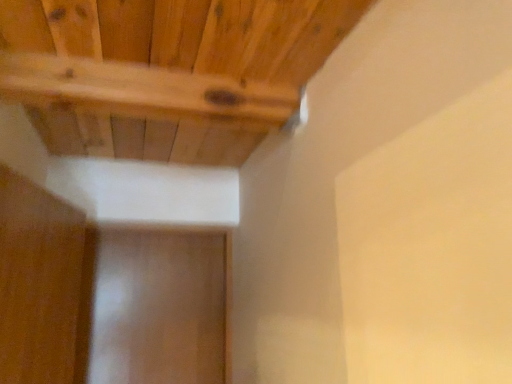
What do you see at coordinates (158, 308) in the screenshot?
I see `matte wood door at center` at bounding box center [158, 308].

Where is `matte wood door at center`? This screenshot has width=512, height=384. matte wood door at center is located at coordinates (158, 308).

Identify the location of matte wood door at center. (158, 308).